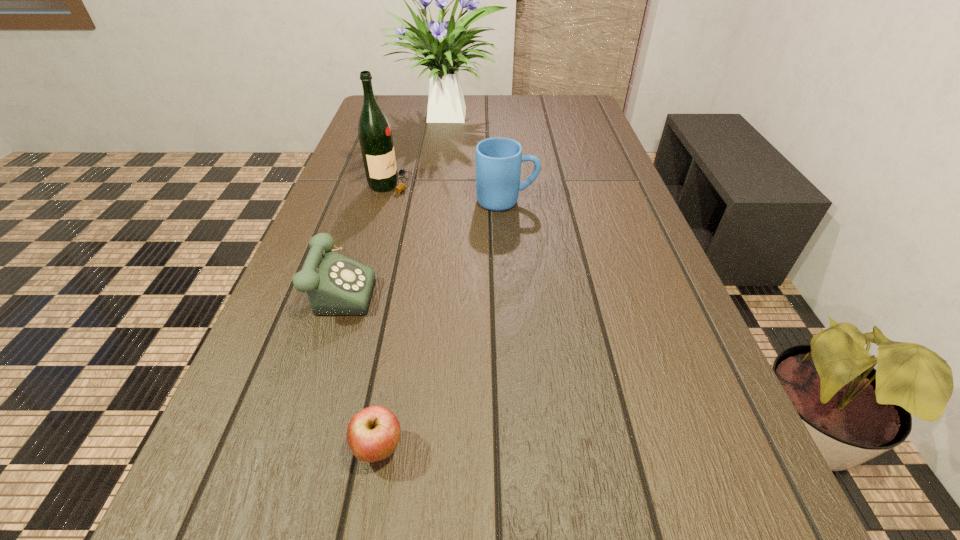
You are a GUI agent. You are given a task and a screenshot of the screen. Output one action in this format:
    pyautogui.click(x=<x>, y=<y>)
    Task: Click on the farthest object
    The height and width of the screenshot is (540, 960).
    Given the screenshot: What is the action you would take?
    (x=446, y=104)

This screenshot has height=540, width=960. I want to click on the tallest object, so click(446, 104).

Locate an element on the screen. The width and height of the screenshot is (960, 540). the second tallest object is located at coordinates (374, 131).

I want to click on mug, so click(498, 160).

Where is `the fourth tallest object`? This screenshot has width=960, height=540. the fourth tallest object is located at coordinates (335, 285).

At what (x,y) coordinates should I click in order to perform the action: click on the fourth farthest object. Please return your answer as a coordinate pair (x, y). This screenshot has width=960, height=540. Looking at the image, I should click on (335, 285).

The width and height of the screenshot is (960, 540). In order to click on the nearest object in this screenshot , I will do `click(373, 433)`.

Locate an element on the screen. The image size is (960, 540). the shortest object is located at coordinates (373, 433).

What are the coordinates of `vacant space located 0.350m on the front of the flower arrangement` in the screenshot? It's located at (433, 211).

The image size is (960, 540). I want to click on free point located on the surface of the fourth shortest object, so click(498, 184).